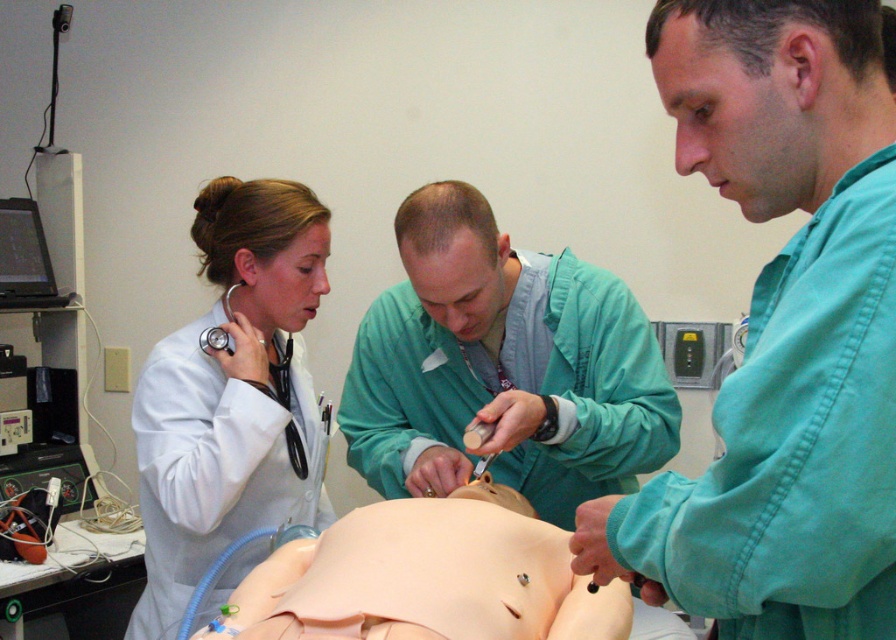
What are the coordinates of `white matte coat at left` in the screenshot? It's located at (231, 394).

Consider the image. Does white matte coat at left have a smaller size compared to matte black stethoscope at left?

No.

Describe the element at coordinates (231, 394) in the screenshot. I see `white matte coat at left` at that location.

Where is `white matte coat at left`? This screenshot has width=896, height=640. white matte coat at left is located at coordinates (231, 394).

Can you confirm if green matte/surgical gown at center is positioned to the left of blue rubber tube at lower center?

No, green matte/surgical gown at center is not to the left of blue rubber tube at lower center.

What do you see at coordinates (502, 365) in the screenshot?
I see `green matte/surgical gown at center` at bounding box center [502, 365].

Measure the distance between green matte/surgical gown at center and camera.

green matte/surgical gown at center is 1.44 meters away from camera.

I want to click on green matte/surgical gown at center, so click(502, 365).

Between point (504, 321) and point (211, 208), which one is positioned behind?

The point (211, 208) is behind.

Is green matte/surgical gown at center thinner than white matte coat at left?

In fact, green matte/surgical gown at center might be wider than white matte coat at left.

Measure the distance between point (412, 285) and camera.

A distance of 1.54 meters exists between point (412, 285) and camera.

The height and width of the screenshot is (640, 896). In order to click on green matte/surgical gown at center in this screenshot , I will do `click(502, 365)`.